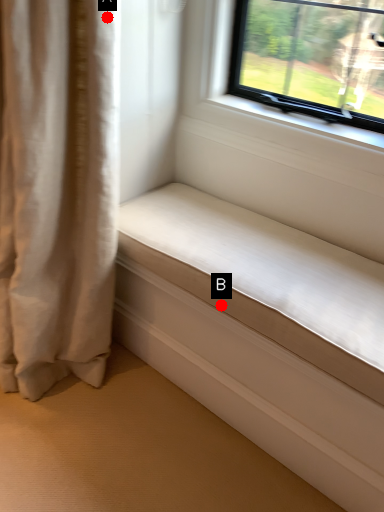
Question: Two points are circled on the image, labeled by A and B beside each circle. Which point appears farthest from the camera in this image?

Choices:
 (A) A is further
 (B) B is further

Answer: (B)